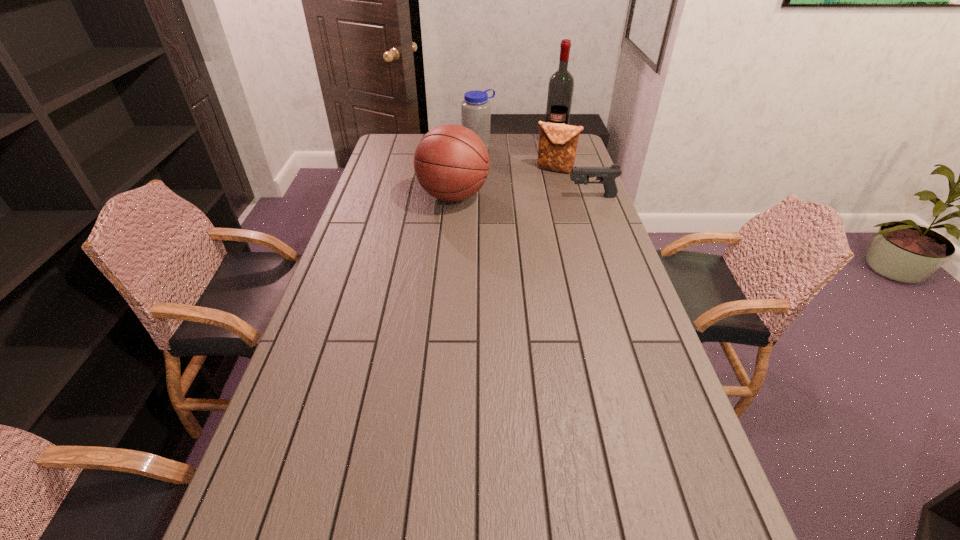
The image size is (960, 540). Find the location of `vacant space that satisfies the following two spatial constraints: 1. on the back side of the water bottle; 2. on the right side of the tallest object`. vacant space that satisfies the following two spatial constraints: 1. on the back side of the water bottle; 2. on the right side of the tallest object is located at coordinates (478, 143).

The height and width of the screenshot is (540, 960). Find the location of `free spot that satisfies the following two spatial constraints: 1. on the back side of the shortest object; 2. at the barrel of the basketball`. free spot that satisfies the following two spatial constraints: 1. on the back side of the shortest object; 2. at the barrel of the basketball is located at coordinates (453, 197).

Locate an element on the screen. This screenshot has height=540, width=960. free space that satisfies the following two spatial constraints: 1. on the front side of the shortest object; 2. at the barrel of the water bottle is located at coordinates (478, 197).